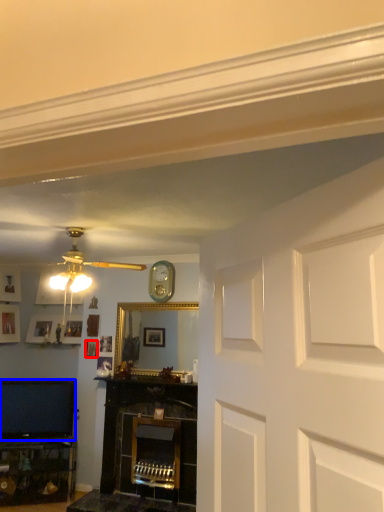
Question: Which point is further to the camera, picture frame (highlighted by a red box) or television (highlighted by a blue box)?

Choices:
 (A) picture frame
 (B) television

Answer: (A)